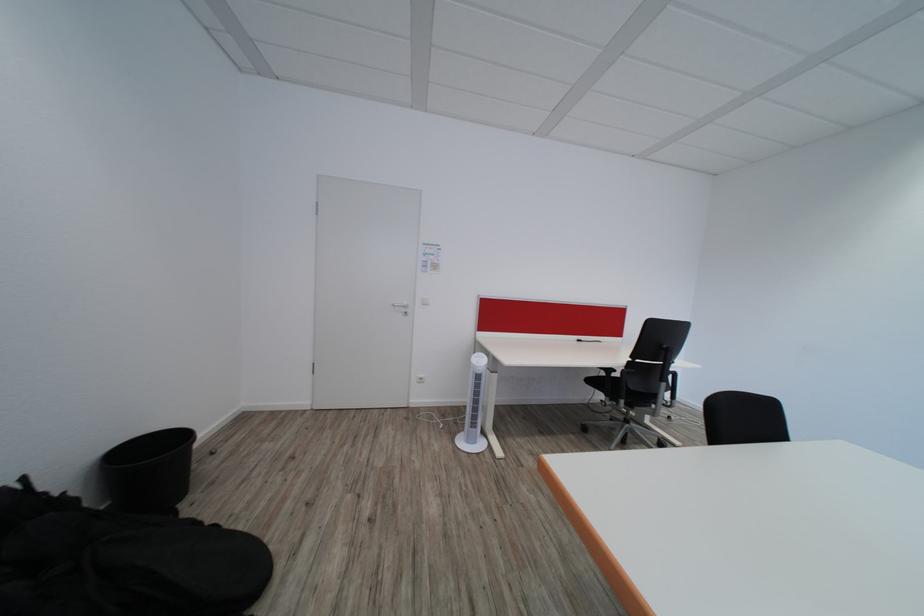
The height and width of the screenshot is (616, 924). I want to click on white light switch, so click(424, 301).